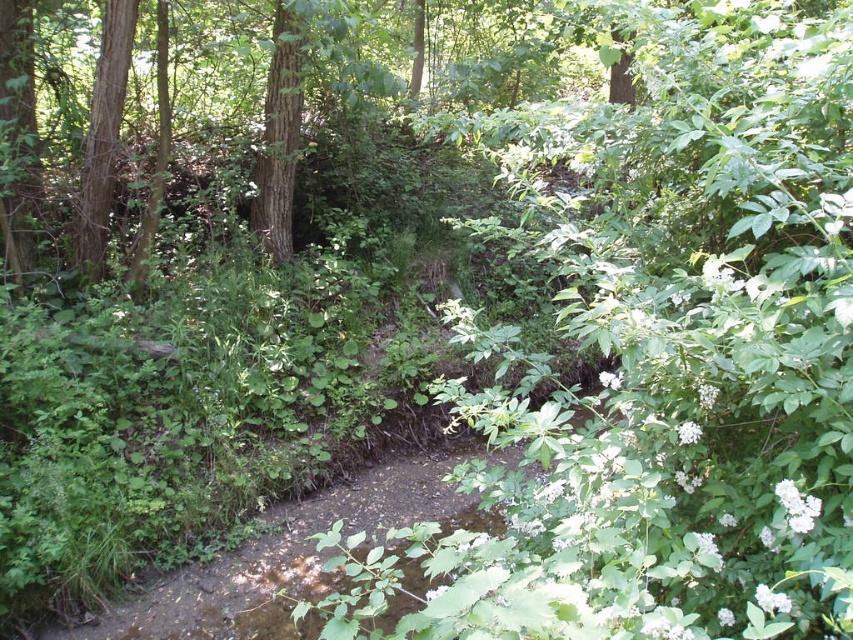
You are a hiker walking along the stream in the forest. You see the smooth brown tree trunk at left and the green rough bark tree at center. Which tree is closer to you?

The smooth brown tree trunk at left is closer to you since it is further to the viewer than the green rough bark tree at center.

You are a hiker trying to cross the stream in the forest. You see a smooth brown tree trunk at left and a green rough bark tree at center. Which tree is closer to your left side when facing the stream?

The smooth brown tree trunk at left is closer to your left side when facing the stream because it is positioned to the left of the green rough bark tree at center.

You are a hiker with a measuring tape. You want to know the distance between the smooth brown tree trunk at left and the green rough bark tree at center. Can you measure it accurately with your tape?

The smooth brown tree trunk at left is 3.99 feet from green rough bark tree at center, so yes, the hiker can measure it accurately with the tape.